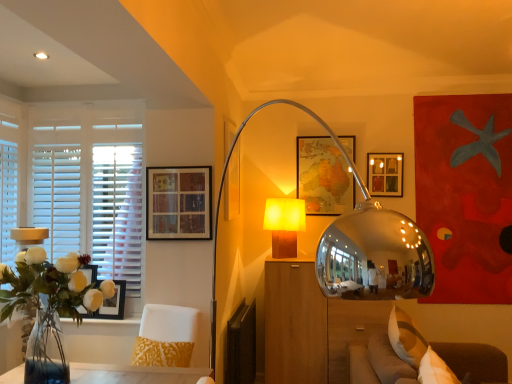
Question: From the image's perspective, is white wooden blinds at left above white fabric swivel chair at lower left?

Choices:
 (A) no
 (B) yes

Answer: (B)

Question: Are white wooden blinds at left and white fabric swivel chair at lower left making contact?

Choices:
 (A) no
 (B) yes

Answer: (A)

Question: Could white fabric swivel chair at lower left be considered to be inside white wooden blinds at left?

Choices:
 (A) yes
 (B) no

Answer: (B)

Question: Considering the relative sizes of white wooden blinds at left and white fabric swivel chair at lower left in the image provided, is white wooden blinds at left shorter than white fabric swivel chair at lower left?

Choices:
 (A) yes
 (B) no

Answer: (B)

Question: From a real-world perspective, is white wooden blinds at left on white fabric swivel chair at lower left?

Choices:
 (A) no
 (B) yes

Answer: (B)

Question: Considering the relative positions of white wooden blinds at left and white fabric swivel chair at lower left in the image provided, is white wooden blinds at left in front of white fabric swivel chair at lower left?

Choices:
 (A) yes
 (B) no

Answer: (B)

Question: Can you confirm if clear glass vase at left is positioned to the right of wooden block lamp at center?

Choices:
 (A) yes
 (B) no

Answer: (B)

Question: Is clear glass vase at left positioned in front of wooden block lamp at center?

Choices:
 (A) no
 (B) yes

Answer: (B)

Question: Does clear glass vase at left have a greater height compared to wooden block lamp at center?

Choices:
 (A) no
 (B) yes

Answer: (B)

Question: Is clear glass vase at left aimed at wooden block lamp at center?

Choices:
 (A) no
 (B) yes

Answer: (A)

Question: From a real-world perspective, is clear glass vase at left beneath wooden block lamp at center?

Choices:
 (A) no
 (B) yes

Answer: (B)

Question: Is clear glass vase at left positioned with its back to wooden block lamp at center?

Choices:
 (A) yes
 (B) no

Answer: (B)

Question: Is matte wooden picture frame at center, the fifth picture frame when ordered from front to back, surrounding matte black picture frame at left, the 1th picture frame from the left?

Choices:
 (A) yes
 (B) no

Answer: (B)